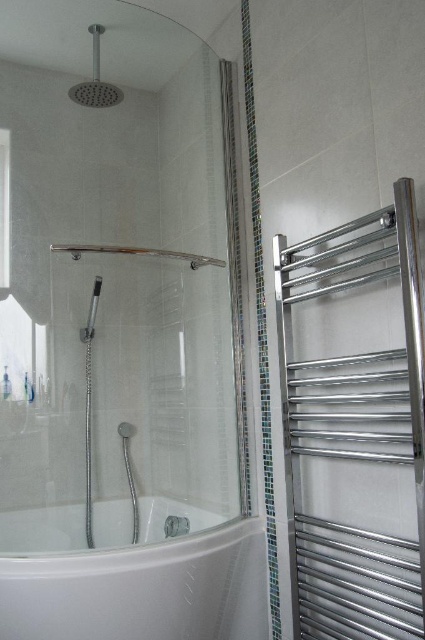
Question: Which object is positioned closest to the polished chrome towel rack at right?

Choices:
 (A) satin nickel showerhead at upper left
 (B) clear glass shower curtain at center

Answer: (B)

Question: Can you confirm if polished chrome towel rack at right is bigger than white glossy bathtub at lower left?

Choices:
 (A) no
 (B) yes

Answer: (B)

Question: Which of these objects is positioned closest to the clear glass shower curtain at center?

Choices:
 (A) white glossy bathtub at lower left
 (B) satin nickel showerhead at upper left
 (C) polished chrome towel rack at right

Answer: (A)

Question: In this image, where is polished chrome towel rack at right located relative to white glossy bathtub at lower left?

Choices:
 (A) right
 (B) left

Answer: (A)

Question: Does white glossy bathtub at lower left appear on the right side of clear glass shower curtain at center?

Choices:
 (A) yes
 (B) no

Answer: (B)

Question: Which is farther from the satin nickel showerhead at upper left?

Choices:
 (A) white glossy bathtub at lower left
 (B) polished chrome towel rack at right

Answer: (B)